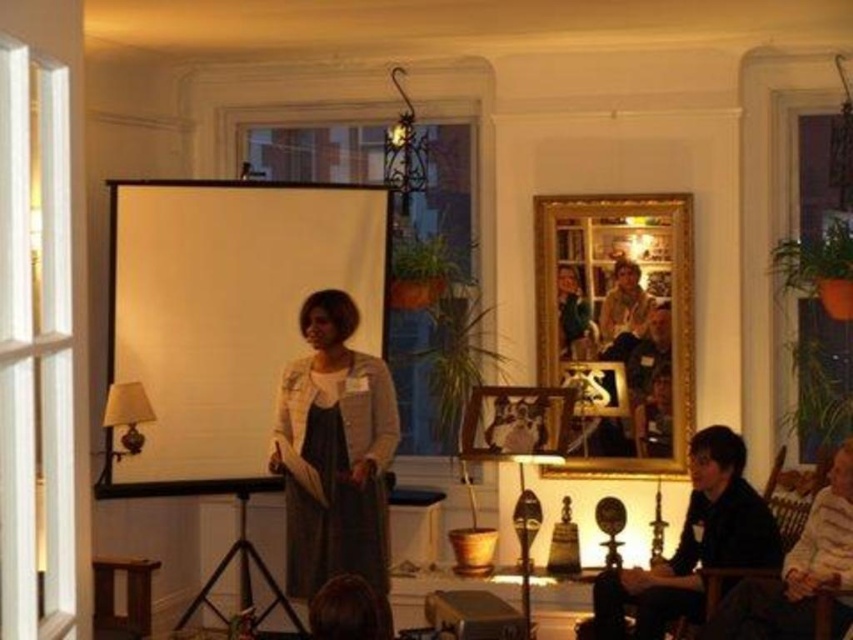
Describe the element at coordinates (335, 456) in the screenshot. I see `matte gray sweater at center` at that location.

Does point (320, 576) come farther from viewer compared to point (843, 490)?

Yes.

Does point (331, 371) lie behind point (830, 616)?

That is True.

This screenshot has width=853, height=640. What are the coordinates of `matte gray sweater at center` in the screenshot? It's located at (335, 456).

Can you confirm if matte gray sweater at center is bigger than black matte jacket at lower right?

Incorrect, matte gray sweater at center is not larger than black matte jacket at lower right.

What do you see at coordinates (335, 456) in the screenshot? This screenshot has width=853, height=640. I see `matte gray sweater at center` at bounding box center [335, 456].

Locate an element on the screen. This screenshot has width=853, height=640. matte gray sweater at center is located at coordinates (335, 456).

Consider the image. Which is above, black matte jacket at lower right or dark brown leather jacket at lower right?

dark brown leather jacket at lower right is above.

Between black matte jacket at lower right and dark brown leather jacket at lower right, which one has more height?

→ black matte jacket at lower right

Is point (747, 556) less distant than point (753, 589)?

No, (747, 556) is behind (753, 589).

Find the location of a particular element. black matte jacket at lower right is located at coordinates (693, 545).